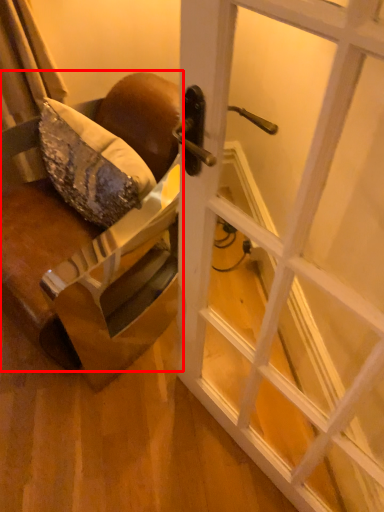
Question: From the image's perspective, considering the relative positions of chair (annotated by the red box) and door in the image provided, where is chair (annotated by the red box) located with respect to the staircase?

Choices:
 (A) below
 (B) above

Answer: (B)